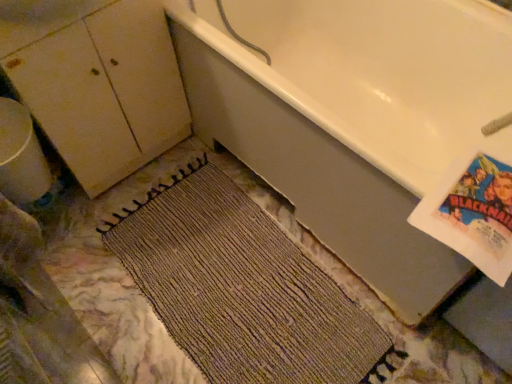
Measure the distance between point (95, 158) and camera.

Point (95, 158) is 4.70 feet from camera.

You are a GUI agent. You are given a task and a screenshot of the screen. Output one action in this format:
    pyautogui.click(x=<x>, y=<y>)
    Task: Click on the white glossy bathtub at upper right
    
    Given the screenshot: What is the action you would take?
    pyautogui.click(x=352, y=116)

In order to face white glossy cabinet at upper left, should I rotate leftwards or rightwards?

To align with it, rotate left about 26.937°.

The image size is (512, 384). What are the coordinates of `brown woven mat at center` in the screenshot? It's located at (240, 287).

Where is `matte white cabinet at left`? The image size is (512, 384). matte white cabinet at left is located at coordinates (97, 82).

Is matte white cabinet at left not close to brown woven mat at center?

No, matte white cabinet at left is not far from brown woven mat at center.

From a real-world perspective, is matte white cabinet at left under brown woven mat at center?

Incorrect, from a real-world perspective, matte white cabinet at left is higher than brown woven mat at center.

Is matte white cabinet at left wider than brown woven mat at center?

Incorrect, the width of matte white cabinet at left does not surpass that of brown woven mat at center.

How different are the orientations of matte white cabinet at left and brown woven mat at center in degrees?

89.4 degrees.

Is brown woven mat at center aimed at white glossy cabinet at upper left?

No, brown woven mat at center is not turned towards white glossy cabinet at upper left.

Between brown woven mat at center and white glossy cabinet at upper left, which one has smaller size?

white glossy cabinet at upper left is smaller.

Which is in front, point (238, 287) or point (54, 21)?

The point (54, 21) is in front.

Between brown woven mat at center and white glossy cabinet at upper left, which one appears on the right side from the viewer's perspective?

Positioned to the right is brown woven mat at center.

Is point (168, 315) closer or farther from the camera than point (441, 51)?

Point (168, 315).

From the picture: Considering the relative sizes of brown woven mat at center and white glossy bathtub at upper right in the image provided, is brown woven mat at center thinner than white glossy bathtub at upper right?

Indeed, brown woven mat at center has a lesser width compared to white glossy bathtub at upper right.

From a real-world perspective, between brown woven mat at center and white glossy bathtub at upper right, who is vertically higher?

In real-world perspective, white glossy bathtub at upper right is above.

Does point (118, 55) come closer to viewer compared to point (433, 281)?

No, (118, 55) is behind (433, 281).

There is a white glossy bathtub at upper right. What are the coordinates of `dresser above it (from a real-world perspective)` in the screenshot? It's located at 97,82.

Which of these two, matte white cabinet at left or white glossy bathtub at upper right, is bigger?

white glossy bathtub at upper right is bigger.

Does point (144, 2) come in front of point (22, 17)?

No, (144, 2) is behind (22, 17).

Based on the photo, who is taller, matte white cabinet at left or white glossy cabinet at upper left?

Standing taller between the two is matte white cabinet at left.

Considering the sizes of objects matte white cabinet at left and white glossy cabinet at upper left in the image provided, who is bigger, matte white cabinet at left or white glossy cabinet at upper left?

matte white cabinet at left.

Based on the photo, would you consider matte white cabinet at left to be distant from white glossy cabinet at upper left?

They are positioned close to each other.

Looking at this image, from a real-world perspective, which object rests below the other?

In real-world perspective, white glossy bathtub at upper right is lower.

Which object is thinner, white glossy bathtub at upper right or matte white cabinet at left?

Thinner between the two is matte white cabinet at left.

Would you say matte white cabinet at left is part of white glossy bathtub at upper right's contents?

Definitely not — matte white cabinet at left is not inside white glossy bathtub at upper right.

Considering the positions of objects white glossy bathtub at upper right and matte white cabinet at left in the image provided, who is more to the left, white glossy bathtub at upper right or matte white cabinet at left?

matte white cabinet at left.

Which is farther from the camera, (65, 21) or (250, 383)?

The point (250, 383) is behind.

From the image's perspective, relative to brown woven mat at center, is white glossy cabinet at upper left above or below?

white glossy cabinet at upper left is above brown woven mat at center.

Relative to brown woven mat at center, is white glossy cabinet at upper left in front or behind?

white glossy cabinet at upper left is positioned closer to the viewer than brown woven mat at center.

What's the angular difference between white glossy cabinet at upper left and brown woven mat at center's facing directions?

They differ by 89.1 degrees in their facing directions.

At what (x,y) coordinates should I click in order to perform the action: click on doormat that is below the matte white cabinet at left (from the image's perspective). Please return your answer as a coordinate pair (x, y). Looking at the image, I should click on (240, 287).

Find the location of a particular element. sink on the left of brown woven mat at center is located at coordinates (38, 19).

When comparing their distances from white glossy cabinet at upper left, does brown woven mat at center or matte white cabinet at left seem closer?

matte white cabinet at left is positioned closer to the anchor white glossy cabinet at upper left.

Which object lies nearer to the anchor point white glossy bathtub at upper right, white glossy cabinet at upper left or matte white cabinet at left?

The object closer to white glossy bathtub at upper right is matte white cabinet at left.

Estimate the real-world distances between objects in this image. Which object is further from matte white cabinet at left, white glossy bathtub at upper right or white glossy cabinet at upper left?

white glossy bathtub at upper right lies further to matte white cabinet at left than the other object.

When comparing their distances from brown woven mat at center, does matte white cabinet at left or white glossy bathtub at upper right seem closer?

white glossy bathtub at upper right.

Which object lies further to the anchor point white glossy bathtub at upper right, matte white cabinet at left or brown woven mat at center?

matte white cabinet at left is further to white glossy bathtub at upper right.

Estimate the real-world distances between objects in this image. Which object is closer to brown woven mat at center, white glossy cabinet at upper left or white glossy bathtub at upper right?

white glossy bathtub at upper right is closer to brown woven mat at center.

Considering their positions, is white glossy bathtub at upper right positioned closer to brown woven mat at center than matte white cabinet at left?

Among the two, white glossy bathtub at upper right is located nearer to brown woven mat at center.

Which object lies nearer to the anchor point matte white cabinet at left, white glossy cabinet at upper left or brown woven mat at center?

white glossy cabinet at upper left.

This screenshot has height=384, width=512. I want to click on bathtub between white glossy cabinet at upper left and brown woven mat at center vertically, so click(x=352, y=116).

You are a GUI agent. You are given a task and a screenshot of the screen. Output one action in this format:
    pyautogui.click(x=<x>, y=<y>)
    Task: Click on the bathtub between matte white cabinet at left and brown woven mat at center vertically
    The height and width of the screenshot is (384, 512).
    Given the screenshot: What is the action you would take?
    pyautogui.click(x=352, y=116)

You are a GUI agent. You are given a task and a screenshot of the screen. Output one action in this format:
    pyautogui.click(x=<x>, y=<y>)
    Task: Click on the dresser between white glossy cabinet at upper left and white glossy bathtub at upper right in the horizontal direction
    The image size is (512, 384).
    Given the screenshot: What is the action you would take?
    pyautogui.click(x=97, y=82)

Where is `dresser between white glossy cabinet at upper left and brown woven mat at center from top to bottom`? dresser between white glossy cabinet at upper left and brown woven mat at center from top to bottom is located at coordinates (97, 82).